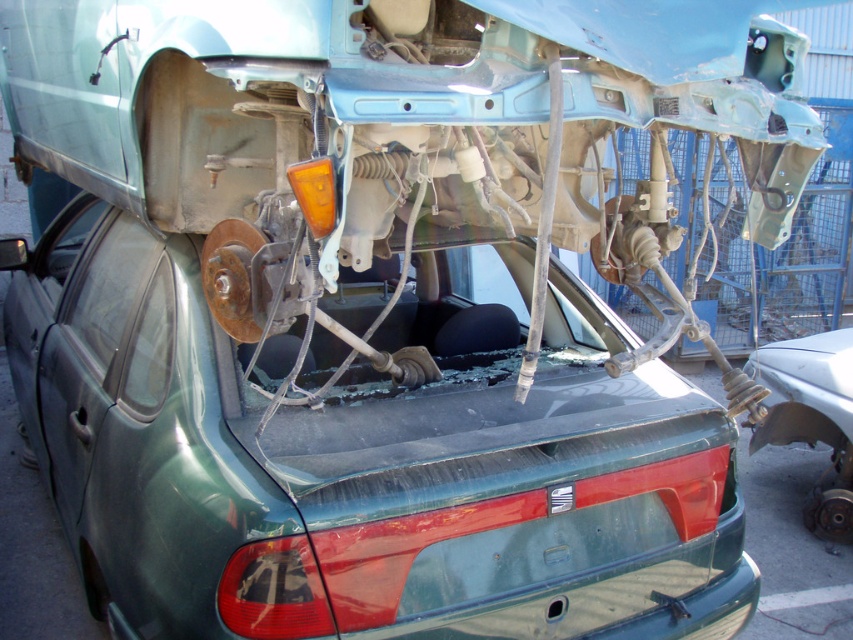
Question: Observing the image, what is the correct spatial positioning of green matte car at center in reference to transparent glass windshield at center?

Choices:
 (A) left
 (B) right

Answer: (A)

Question: Which point is closer to the camera?

Choices:
 (A) (386, 326)
 (B) (805, 384)

Answer: (A)

Question: Is the position of green matte car at center less distant than that of transparent glass windshield at center?

Choices:
 (A) no
 (B) yes

Answer: (B)

Question: Which object is positioned closest to the transparent glass windshield at center?

Choices:
 (A) rusty metal brake disc at lower right
 (B) green matte car at center

Answer: (B)

Question: Does green matte car at center come behind transparent glass windshield at center?

Choices:
 (A) no
 (B) yes

Answer: (A)

Question: Which of the following is the farthest from the observer?

Choices:
 (A) (103, 212)
 (B) (326, 362)
 (C) (775, 422)

Answer: (C)